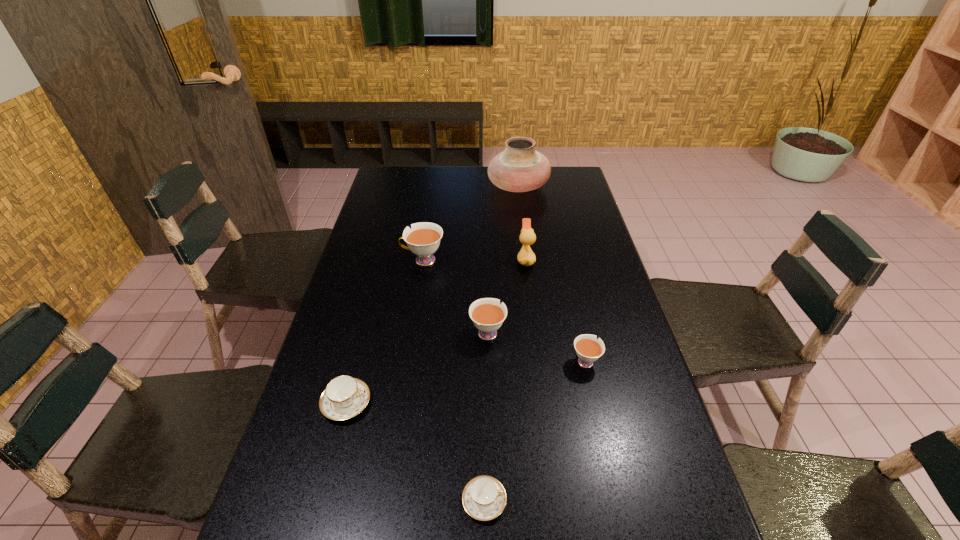
Where is `vacant area between the leftmost white teacup and the second nearest teacup`? vacant area between the leftmost white teacup and the second nearest teacup is located at coordinates (385, 332).

Locate an element on the screen. empty space between the pottery and the tan duck is located at coordinates (522, 224).

The image size is (960, 540). Identify the location of free space between the nearer blue teacup and the tallest teacup. (453, 381).

Image resolution: width=960 pixels, height=540 pixels. I want to click on the sixth closest object relative to the second white teacup from left to right, so click(x=520, y=168).

Point out which object is positioned as the fourth nearest to the second biggest white teacup. Please provide its 2D coordinates. Your answer should be formatted as a tuple, i.e. [(x, y)], where the tuple contains the x and y coordinates of a point satisfying the conditions above.

[(344, 397)]

The image size is (960, 540). Find the location of `the closest teacup to the rightmost teacup`. the closest teacup to the rightmost teacup is located at coordinates (487, 314).

Locate which teacup ranks third in proximity to the smallest white teacup. Please provide its 2D coordinates. Your answer should be formatted as a tuple, i.e. [(x, y)], where the tuple contains the x and y coordinates of a point satisfying the conditions above.

[(423, 240)]

Where is `white teacup that is the second closest to the pottery`? The image size is (960, 540). white teacup that is the second closest to the pottery is located at coordinates (487, 314).

Where is `the closest white teacup relative to the leftmost white teacup`? The image size is (960, 540). the closest white teacup relative to the leftmost white teacup is located at coordinates (487, 314).

Locate an element on the screen. free region that satisfies the following two spatial constraints: 1. on the side of the smallest white teacup with the handle; 2. on the beak of the tan duck is located at coordinates point(563,260).